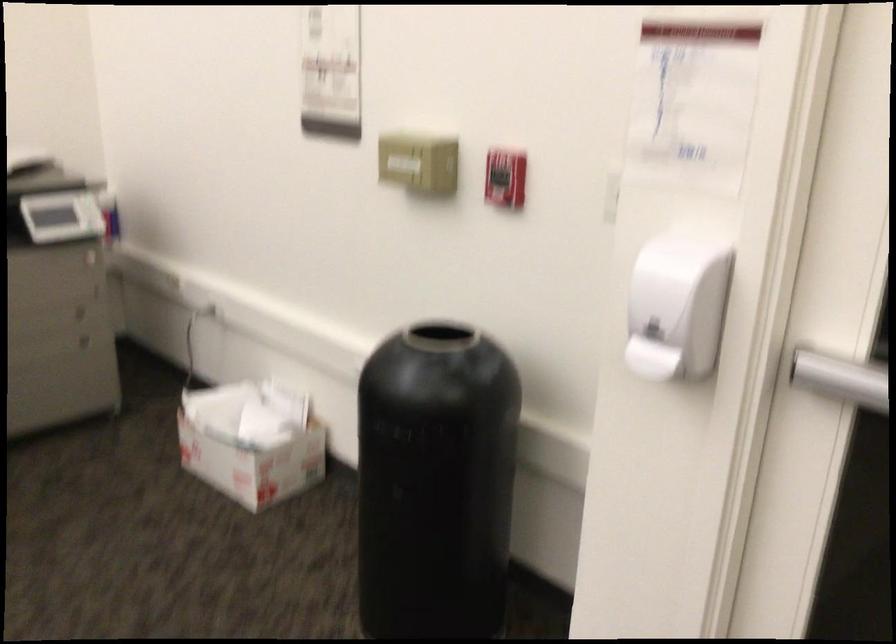
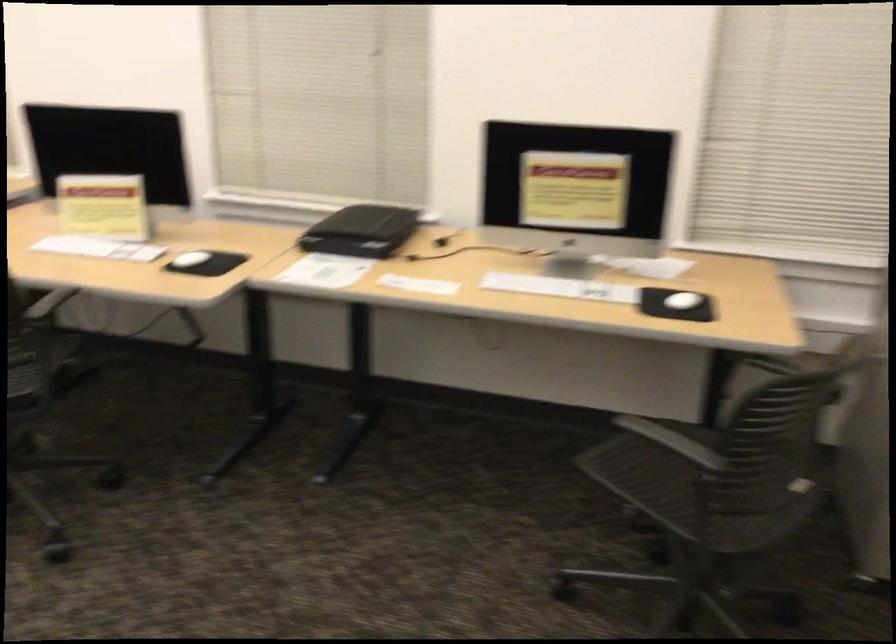
Question: The camera is either moving clockwise (left) or counter-clockwise (right) around the object. The first image is from the beginning of the video and the second image is from the end. Is the camera moving left or right when shooting the video?

Choices:
 (A) Left
 (B) Right

Answer: (B)